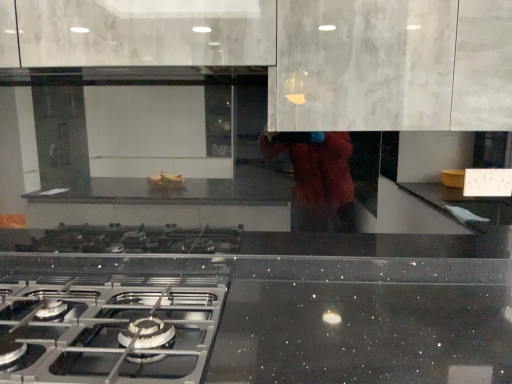
In order to face satin silver gas stove at lower left, should I rotate leftwards or rightwards?

A 22.759 degree turn to the left will do.

Locate an element on the screen. The image size is (512, 384). satin silver gas stove at lower left is located at coordinates (108, 329).

What do you see at coordinates (108, 329) in the screenshot? Image resolution: width=512 pixels, height=384 pixels. I see `satin silver gas stove at lower left` at bounding box center [108, 329].

This screenshot has width=512, height=384. I want to click on satin silver gas stove at lower left, so 108,329.